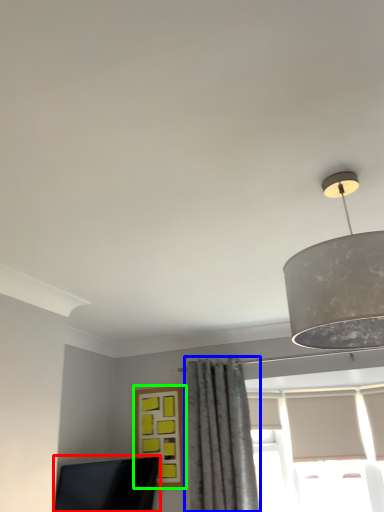
Question: Which is nearer to the computer monitor (highlighted by a red box)? curtain (highlighted by a blue box) or window (highlighted by a green box).

Choices:
 (A) curtain
 (B) window

Answer: (B)